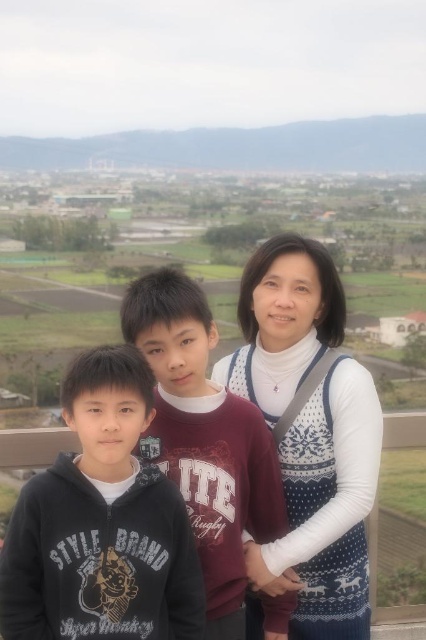
You are standing in the scenic outdoor area shown in the image and want to walk from point (296, 273) to point (193, 385). Which direction should you move relative to your current position?

You should move away from the viewer because point (296, 273) is closer to you than point (193, 385), so moving away would take you towards the latter.

You are trying to decide which clothing item to take for a chilly day based on their sizes. The white sweater at center and the matte black hoodie at center are both available. Which one offers more warmth due to its size?

The white sweater at center has a larger size compared to the matte black hoodie at center, so it offers more warmth.